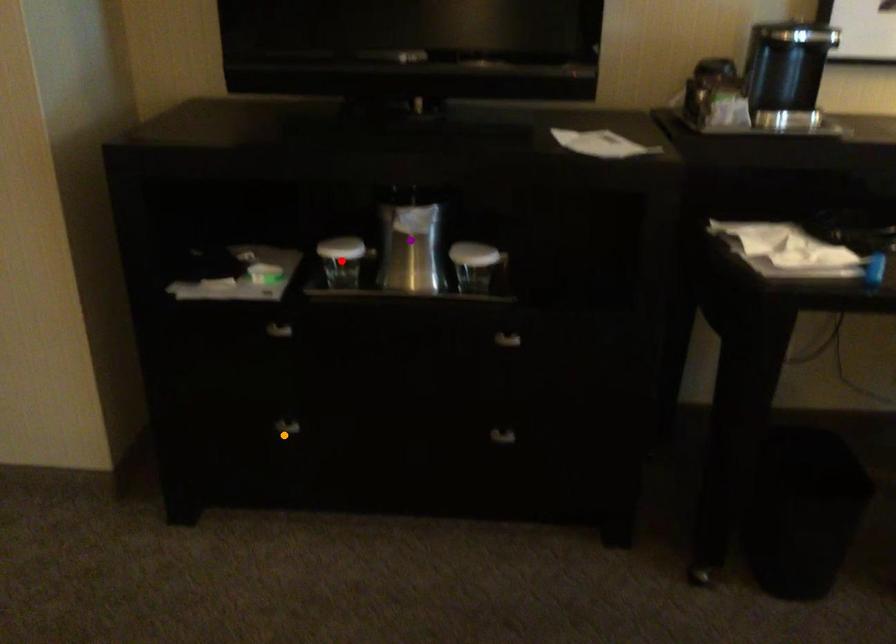
Order these from nearest to farthest:
red point | orange point | purple point

red point < purple point < orange point